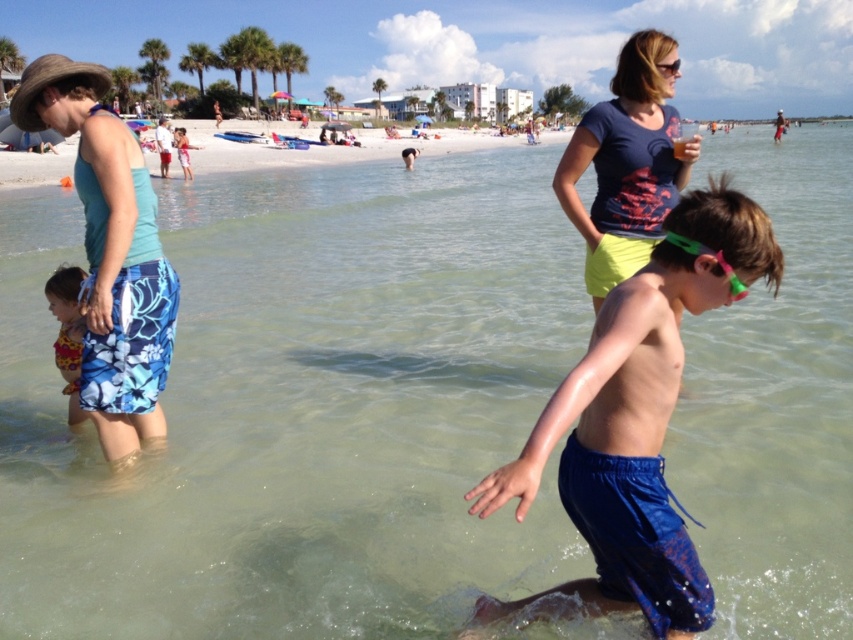
You are a photographer trying to capture a photo of the beach scene. You need to ensure that both the blue fabric shorts at center and the printed fabric swimsuit at lower left are clearly visible in the frame. Given their sizes, which of these two items would appear wider in the photo?

The blue fabric shorts at center would appear wider in the photo because its width surpasses that of the printed fabric swimsuit at lower left.

Consider the image. You are a photographer trying to capture a photo of the teal fabric tank top at left and the white sand beach at center. Based on their sizes in the image, which object would appear smaller in the final photo?

The teal fabric tank top at left appears smaller in the photo because it is not as tall as the white sand beach at center.

You are standing at the beach and want to walk towards the two points marked in the image. Which point, point (113, 160) or point (676, 173), will you reach first?

Point (113, 160) is closer to the viewer than point (676, 173), so you will reach point (113, 160) first.